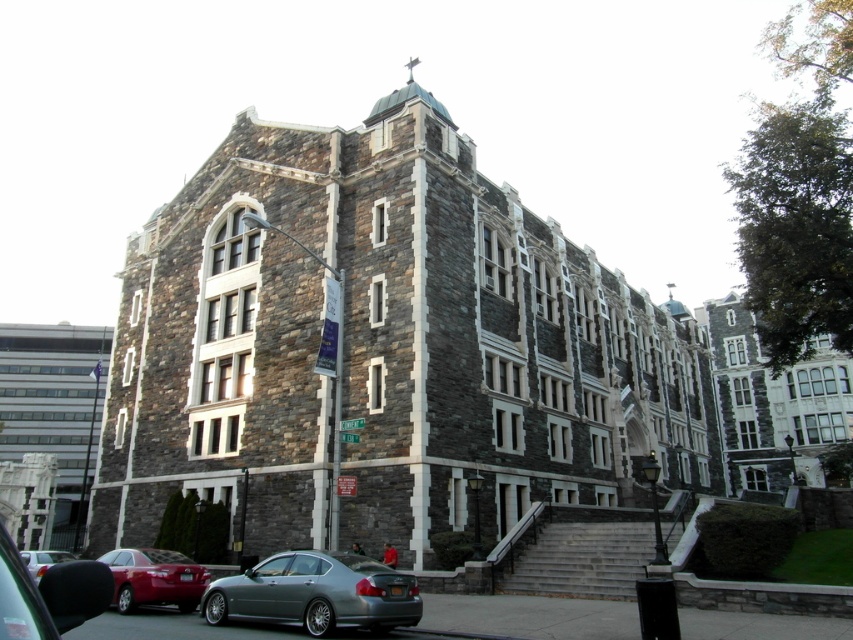
Is point (819, 417) positioned before point (32, 573)?

No, (819, 417) is behind (32, 573).

This screenshot has height=640, width=853. Describe the element at coordinates (773, 403) in the screenshot. I see `stone building at center` at that location.

At what (x,y) coordinates should I click in order to perform the action: click on stone building at center. Please return your answer as a coordinate pair (x, y). Image resolution: width=853 pixels, height=640 pixels. Looking at the image, I should click on (773, 403).

Which of these two, stone building at center or silver metallic sedan at lower left, stands taller?

stone building at center is taller.

Can you confirm if stone building at center is shorter than silver metallic sedan at lower left?

Incorrect, stone building at center's height does not fall short of silver metallic sedan at lower left's.

You are a GUI agent. You are given a task and a screenshot of the screen. Output one action in this format:
    pyautogui.click(x=<x>, y=<y>)
    Task: Click on the stone building at center
    Image resolution: width=853 pixels, height=640 pixels.
    Given the screenshot: What is the action you would take?
    pyautogui.click(x=773, y=403)

Is silver metallic sedan at lower left to the left of metallic silver sedan at lower left from the viewer's perspective?

Incorrect, silver metallic sedan at lower left is not on the left side of metallic silver sedan at lower left.

Who is shorter, silver metallic sedan at lower left or metallic silver sedan at lower left?

Standing shorter between the two is metallic silver sedan at lower left.

Between point (347, 572) and point (107, 572), which one is positioned behind?

Positioned behind is point (347, 572).

Find the location of a particular element. The image size is (853, 640). silver metallic sedan at lower left is located at coordinates (316, 593).